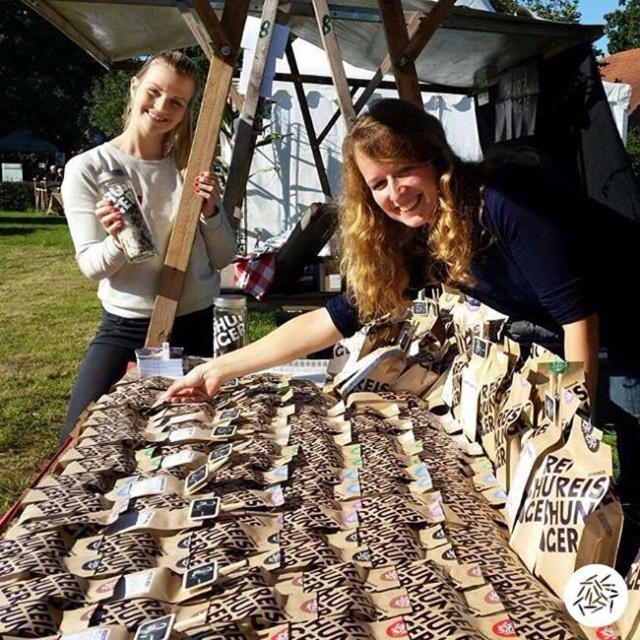
You are standing in the market and see the matte white sweater at upper left and the brown paper bag at center. Which object is taller?

The matte white sweater at upper left is taller than the brown paper bag at center.

Where are the brown paper bags at center located in the image?

The brown paper bags at center are located at point (x=300, y=522) in the image.